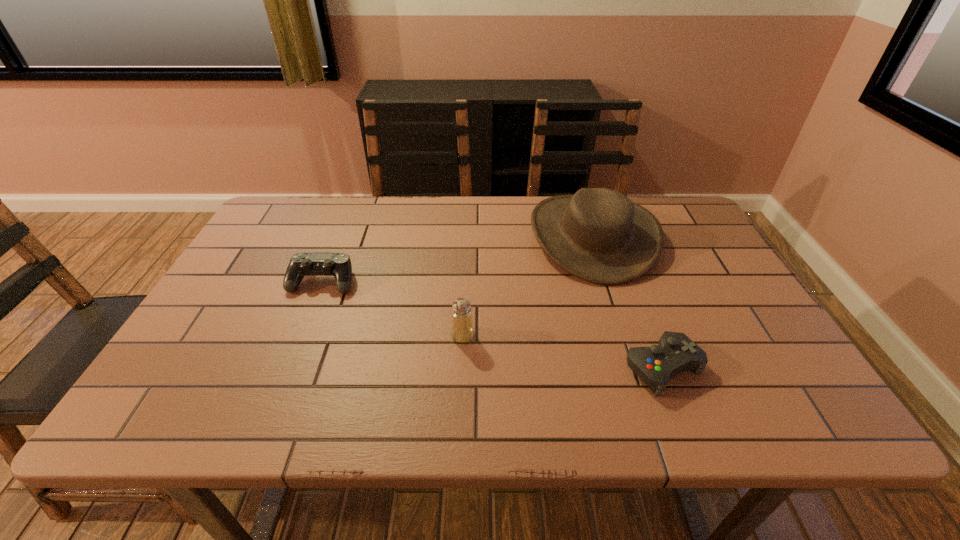
Identify the location of cowboy hat. (599, 235).

Find the location of a particular element. The height and width of the screenshot is (540, 960). the third object from right to left is located at coordinates (462, 330).

Find the location of a particular element. This screenshot has width=960, height=540. saltshaker is located at coordinates (462, 330).

Identify the location of the left control. The height and width of the screenshot is (540, 960). (339, 265).

Locate an element on the screen. The image size is (960, 540). the farther control is located at coordinates (339, 265).

The image size is (960, 540). I want to click on the nearer control, so click(x=675, y=352).

Where is `free location located on the right of the cowboy hat`? The height and width of the screenshot is (540, 960). free location located on the right of the cowboy hat is located at coordinates (680, 236).

Locate an element on the screen. The height and width of the screenshot is (540, 960). vacant space situated on the back of the saltshaker is located at coordinates (464, 312).

Find the location of a particular element. This screenshot has width=960, height=540. vacant space situated on the back of the leftmost object is located at coordinates (340, 239).

The width and height of the screenshot is (960, 540). Find the location of `free region located on the left of the nearer control`. free region located on the left of the nearer control is located at coordinates (507, 368).